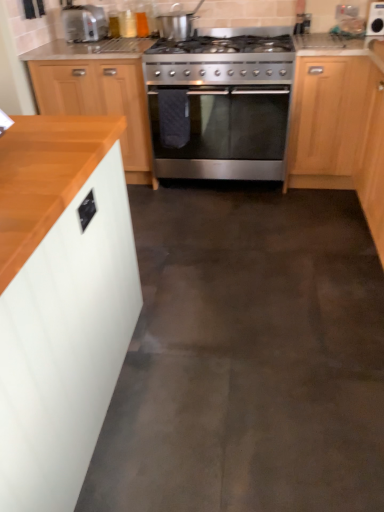
Question: In terms of width, does wooden cabinet at left, the third cabinetry when ordered from front to back, look wider or thinner when compared to stainless steel gas stove at center?

Choices:
 (A) thin
 (B) wide

Answer: (A)

Question: Relative to stainless steel gas stove at center, is wooden cabinet at left, the 2th cabinetry when ordered from left to right, in front or behind?

Choices:
 (A) behind
 (B) front

Answer: (A)

Question: Which object is positioned closest to the light wood cabinet at right, which is the 2th cabinetry in back-to-front order?

Choices:
 (A) satin silver pot at upper center, marked as the second appliance in a right-to-left arrangement
 (B) stainless steel oven at center
 (C) white matte cabinet at left, which is the 1th cabinetry from left to right
 (D) matte silver toaster at upper left
 (E) white glossy microwave at upper right, which is counted as the 1th appliance, starting from the right

Answer: (B)

Question: Considering the real-world distances, which object is closest to the white glossy microwave at upper right, which ranks as the 2th appliance in left-to-right order?

Choices:
 (A) wooden cabinet at left, the 2th cabinetry when ordered from left to right
 (B) white matte cabinet at left, which is the 1th cabinetry from left to right
 (C) stainless steel gas stove at center
 (D) light wood cabinet at right, positioned as the third cabinetry in left-to-right order
 (E) matte silver toaster at upper left

Answer: (D)